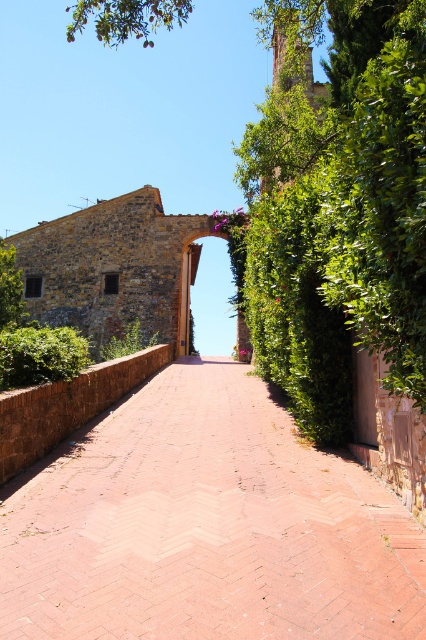
Question: Which point is farther to the camera?

Choices:
 (A) 218,262
 (B) 397,205

Answer: (A)

Question: Does brick paved path at center appear on the left side of stone archway at center?

Choices:
 (A) yes
 (B) no

Answer: (A)

Question: Does brick paved path at center appear on the right side of stone archway at center?

Choices:
 (A) yes
 (B) no

Answer: (B)

Question: Which point appears farthest from the camera in this image?

Choices:
 (A) (199, 532)
 (B) (198, 301)
 (C) (419, 298)

Answer: (B)

Question: Which point appears farthest from the camera in this image?

Choices:
 (A) (222, 285)
 (B) (313, 188)
 (C) (239, 465)

Answer: (A)

Question: Is brick paved path at center to the left of stone archway at center from the viewer's perspective?

Choices:
 (A) no
 (B) yes

Answer: (B)